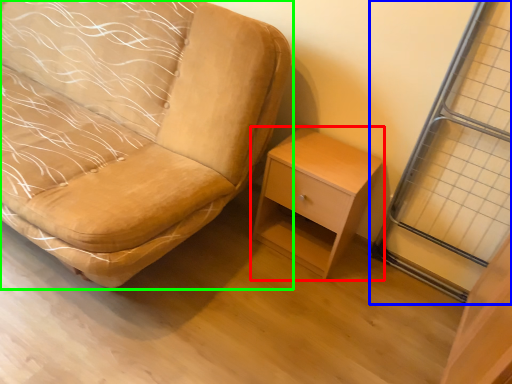
Question: Which is nearer to the nightstand (highlighted by a red box)? screen door (highlighted by a blue box) or chair (highlighted by a green box).

Choices:
 (A) screen door
 (B) chair

Answer: (A)